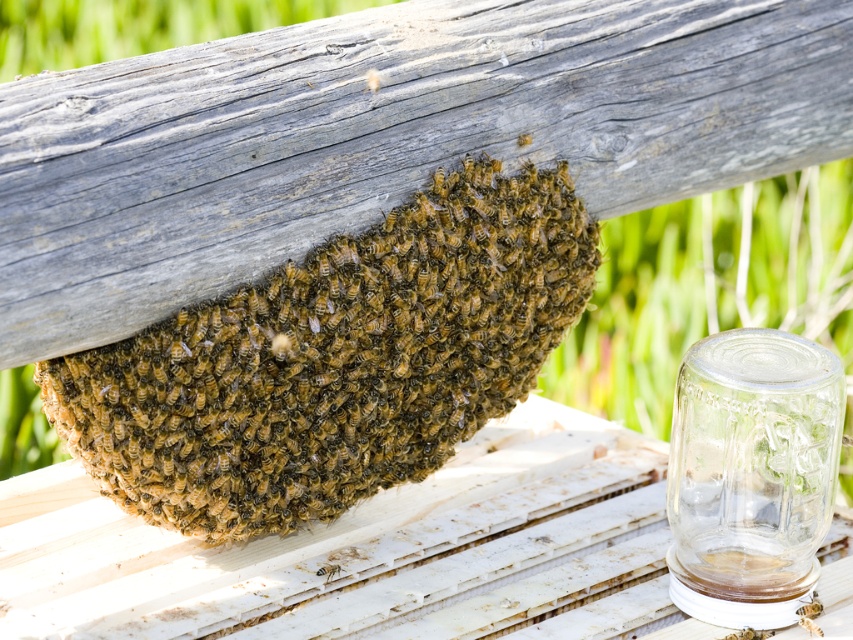
Question: Which object is the closest to the brown fuzzy beehive at center?

Choices:
 (A) translucent yellowish honeycomb at lower center
 (B) clear glass jar at right

Answer: (A)

Question: From the image, what is the correct spatial relationship of brown fuzzy beehive at center in relation to translucent yellowish honeycomb at lower center?

Choices:
 (A) right
 (B) left

Answer: (A)

Question: Does brown fuzzy beehive at center appear on the right side of translucent yellowish honeycomb at lower center?

Choices:
 (A) no
 (B) yes

Answer: (B)

Question: Among these points, which one is nearest to the camera?

Choices:
 (A) (339, 568)
 (B) (70, 371)
 (C) (688, 589)

Answer: (B)

Question: Is brown fuzzy beehive at center to the right of clear glass jar at right from the viewer's perspective?

Choices:
 (A) yes
 (B) no

Answer: (B)

Question: Considering the real-world distances, which object is farthest from the translucent yellowish honeycomb at lower center?

Choices:
 (A) clear glass jar at right
 (B) brown fuzzy beehive at center

Answer: (A)